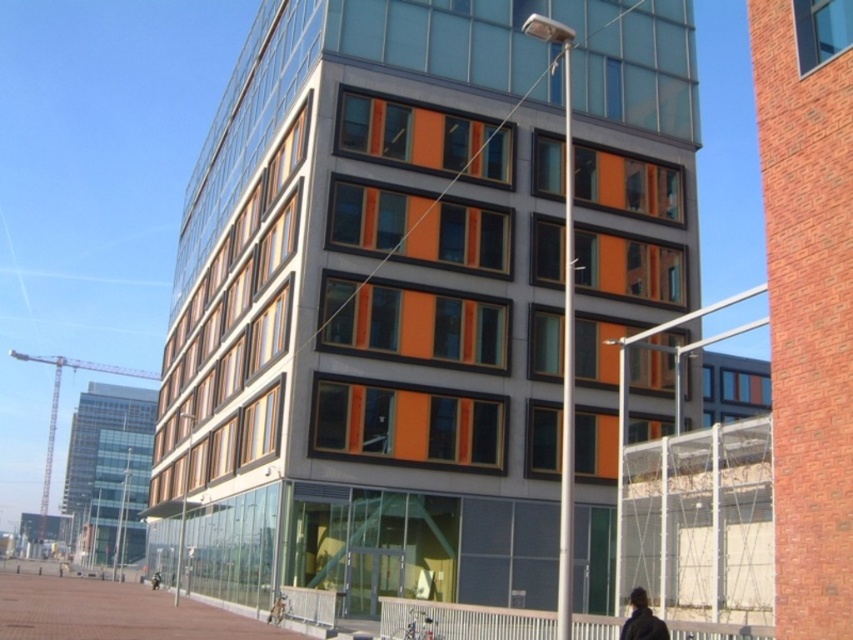
Question: Which point is closer to the camera?

Choices:
 (A) dark brown leather jacket at lower right
 (B) brick pavement at lower left

Answer: (A)

Question: Considering the real-world distances, which object is closest to the dark brown leather jacket at lower right?

Choices:
 (A) dark gray jacket at lower center
 (B) brick pavement at lower left

Answer: (B)

Question: Which point is closer to the camera?

Choices:
 (A) dark gray jacket at lower center
 (B) brick pavement at lower left

Answer: (B)

Question: Is the position of dark brown leather jacket at lower right more distant than that of dark gray jacket at lower center?

Choices:
 (A) no
 (B) yes

Answer: (A)

Question: Is brick pavement at lower left above dark brown leather jacket at lower right?

Choices:
 (A) yes
 (B) no

Answer: (B)

Question: Observing the image, what is the correct spatial positioning of brick pavement at lower left in reference to dark brown leather jacket at lower right?

Choices:
 (A) left
 (B) right

Answer: (A)